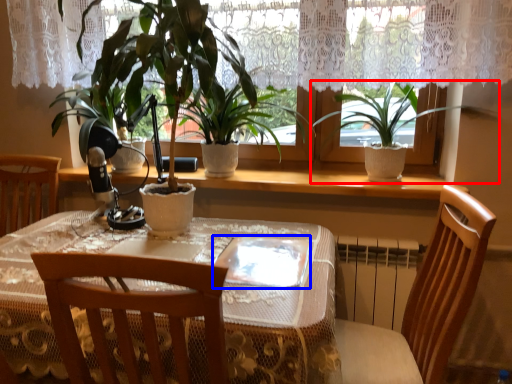
Question: Which point is further to the camera, houseplant (highlighted by a red box) or glass plate (highlighted by a blue box)?

Choices:
 (A) houseplant
 (B) glass plate

Answer: (A)